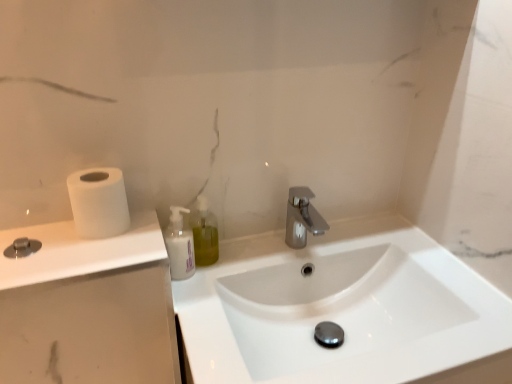
Identify the location of free space in front of white matte bottle at center. (196, 311).